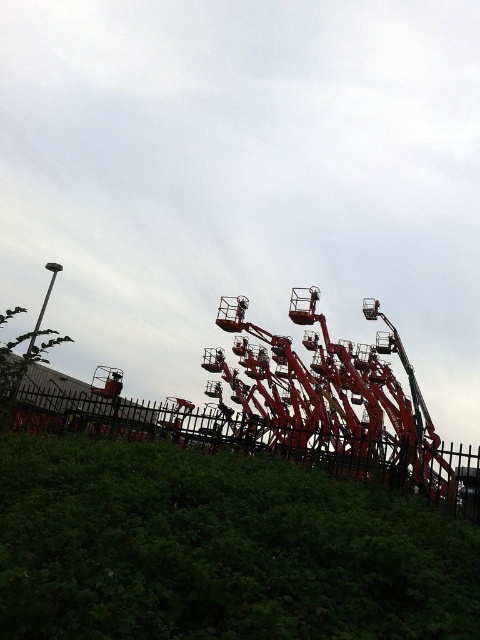
Between metallic orange amusement park ride at center and metallic red amusement ride at center, which one appears on the right side from the viewer's perspective?

From the viewer's perspective, metallic red amusement ride at center appears more on the right side.

Does metallic orange amusement park ride at center appear on the right side of metallic red amusement ride at center?

Incorrect, metallic orange amusement park ride at center is not on the right side of metallic red amusement ride at center.

Is point (139, 440) farther from camera compared to point (415, 433)?

No.

This screenshot has width=480, height=640. I want to click on metallic orange amusement park ride at center, so click(x=225, y=525).